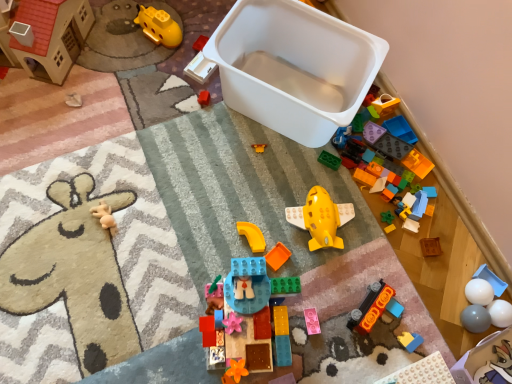
You are a GUI agent. You are given a task and a screenshot of the screen. Output one action in this format:
    pyautogui.click(x=<x>, y=<y>)
    Task: Click on the vacant space that's between yellow matte airplane at center, the 8th toy from the left, and cardboard house at upper left, which is the sixteenth toy in right-to-left order
    Image resolution: width=512 pixels, height=384 pixels.
    Given the screenshot: What is the action you would take?
    pyautogui.click(x=167, y=138)